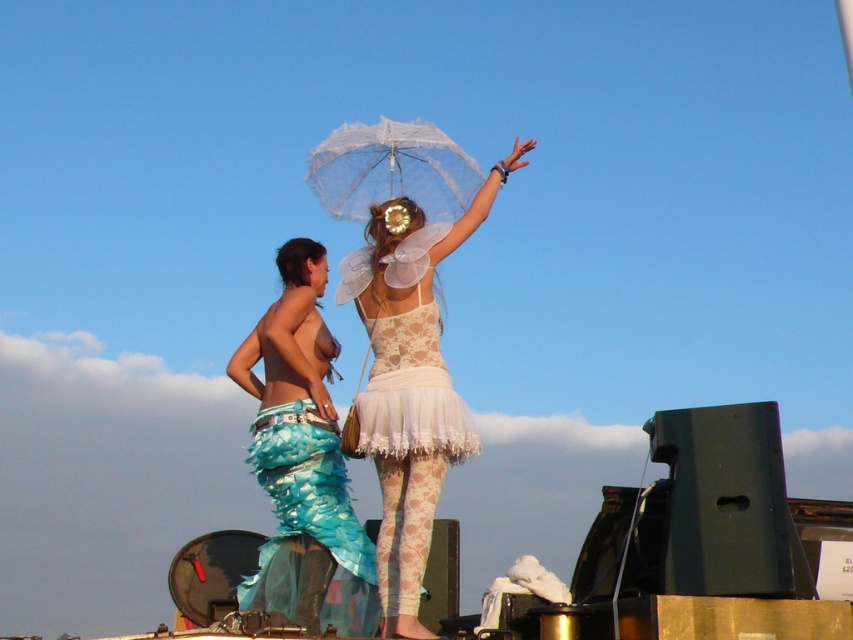
Question: Is lace fabric tutu at center above transparent lace umbrella at center?

Choices:
 (A) yes
 (B) no

Answer: (B)

Question: Estimate the real-world distances between objects in this image. Which object is closer to the lace/sheer white dress at center?

Choices:
 (A) teal fabric mermaid tail at lower left
 (B) transparent lace umbrella at center

Answer: (A)

Question: Is lace fabric tutu at center wider than lace/sheer white dress at center?

Choices:
 (A) no
 (B) yes

Answer: (B)

Question: Does lace/sheer white dress at center appear under transparent lace umbrella at center?

Choices:
 (A) yes
 (B) no

Answer: (A)

Question: Which point appears farthest from the camera in this image?

Choices:
 (A) (457, 186)
 (B) (373, 435)
 (C) (294, 291)

Answer: (C)

Question: Considering the real-world distances, which object is farthest from the teal fabric mermaid tail at lower left?

Choices:
 (A) lace/sheer white dress at center
 (B) lace fabric tutu at center

Answer: (A)